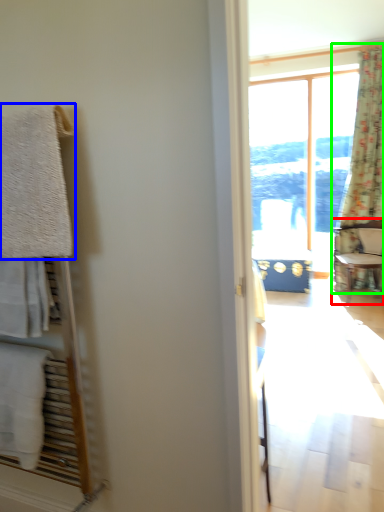
Question: Which is nearer to the chair (highlighted by a red box)? towel/napkin (highlighted by a blue box) or curtain (highlighted by a green box).

Choices:
 (A) towel/napkin
 (B) curtain

Answer: (B)